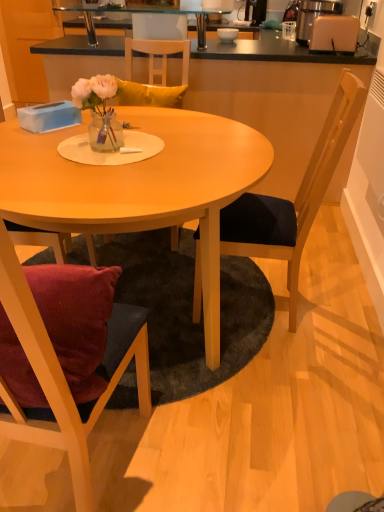
Question: Is beige plastic toaster at upper right smaller than matte white bowl at upper center?

Choices:
 (A) yes
 (B) no

Answer: (B)

Question: Is beige plastic toaster at upper right surrounding matte white bowl at upper center?

Choices:
 (A) no
 (B) yes

Answer: (A)

Question: Is beige plastic toaster at upper right shorter than matte white bowl at upper center?

Choices:
 (A) yes
 (B) no

Answer: (B)

Question: Is beige plastic toaster at upper right next to matte white bowl at upper center?

Choices:
 (A) no
 (B) yes

Answer: (A)

Question: From a real-world perspective, is beige plastic toaster at upper right on matte white bowl at upper center?

Choices:
 (A) no
 (B) yes

Answer: (B)

Question: Based on their positions, is wooden chair at left, marked as the 1th chair in a left-to-right arrangement, located to the left or right of white plastic toaster at upper right?

Choices:
 (A) right
 (B) left

Answer: (B)

Question: Considering the positions of wooden chair at left, the 2th chair in the right-to-left sequence, and white plastic toaster at upper right in the image, is wooden chair at left, the 2th chair in the right-to-left sequence, taller or shorter than white plastic toaster at upper right?

Choices:
 (A) tall
 (B) short

Answer: (A)

Question: From a real-world perspective, is wooden chair at left, marked as the 1th chair in a left-to-right arrangement, physically located above or below white plastic toaster at upper right?

Choices:
 (A) above
 (B) below

Answer: (B)

Question: From the image's perspective, relative to white plastic toaster at upper right, is wooden chair at left, marked as the 1th chair in a left-to-right arrangement, above or below?

Choices:
 (A) below
 (B) above

Answer: (A)

Question: Relative to translucent glass vase at center, is wooden chair at upper center in front or behind?

Choices:
 (A) behind
 (B) front

Answer: (A)

Question: From their relative heights in the image, would you say wooden chair at upper center is taller or shorter than translucent glass vase at center?

Choices:
 (A) tall
 (B) short

Answer: (B)

Question: Based on their positions, is wooden chair at upper center located to the left or right of translucent glass vase at center?

Choices:
 (A) right
 (B) left

Answer: (A)

Question: From a real-world perspective, is wooden chair at upper center physically located above or below translucent glass vase at center?

Choices:
 (A) above
 (B) below

Answer: (A)

Question: From their relative heights in the image, would you say smooth black countertop at upper center is taller or shorter than white plastic toaster at upper right?

Choices:
 (A) tall
 (B) short

Answer: (A)

Question: Based on their positions, is smooth black countertop at upper center located to the left or right of white plastic toaster at upper right?

Choices:
 (A) right
 (B) left

Answer: (B)